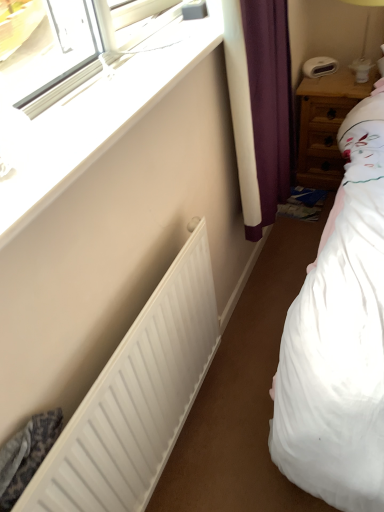
Question: Can wooden nightstand at right be found inside white plastic bedside lamp at upper right?

Choices:
 (A) yes
 (B) no

Answer: (B)

Question: From the image's perspective, is white plastic bedside lamp at upper right over wooden nightstand at right?

Choices:
 (A) yes
 (B) no

Answer: (A)

Question: Does white plastic bedside lamp at upper right have a larger size compared to wooden nightstand at right?

Choices:
 (A) yes
 (B) no

Answer: (B)

Question: Does white plastic bedside lamp at upper right turn towards wooden nightstand at right?

Choices:
 (A) yes
 (B) no

Answer: (B)

Question: Is white plastic bedside lamp at upper right turned away from wooden nightstand at right?

Choices:
 (A) yes
 (B) no

Answer: (B)

Question: Is wooden nightstand at right bigger or smaller than white plastic bedside lamp at upper right?

Choices:
 (A) big
 (B) small

Answer: (A)

Question: Considering the positions of wooden nightstand at right and white plastic bedside lamp at upper right in the image, is wooden nightstand at right wider or thinner than white plastic bedside lamp at upper right?

Choices:
 (A) thin
 (B) wide

Answer: (B)

Question: From the image's perspective, relative to white plastic bedside lamp at upper right, is wooden nightstand at right above or below?

Choices:
 (A) above
 (B) below

Answer: (B)

Question: From a real-world perspective, relative to white plastic bedside lamp at upper right, is wooden nightstand at right vertically above or below?

Choices:
 (A) below
 (B) above

Answer: (A)

Question: In terms of height, does white plastic window at upper left look taller or shorter compared to wooden nightstand at right?

Choices:
 (A) tall
 (B) short

Answer: (B)

Question: Is white plastic window at upper left bigger or smaller than wooden nightstand at right?

Choices:
 (A) small
 (B) big

Answer: (A)

Question: Is point (36, 142) positioned closer to the camera than point (316, 187)?

Choices:
 (A) farther
 (B) closer

Answer: (B)

Question: In the image, is white plastic window at upper left positioned in front of or behind wooden nightstand at right?

Choices:
 (A) front
 (B) behind

Answer: (A)

Question: Based on their positions, is white plastic bedside lamp at upper right located to the left or right of white matte radiator at lower left?

Choices:
 (A) left
 (B) right

Answer: (B)

Question: Considering their positions, is white plastic bedside lamp at upper right located in front of or behind white matte radiator at lower left?

Choices:
 (A) front
 (B) behind

Answer: (B)